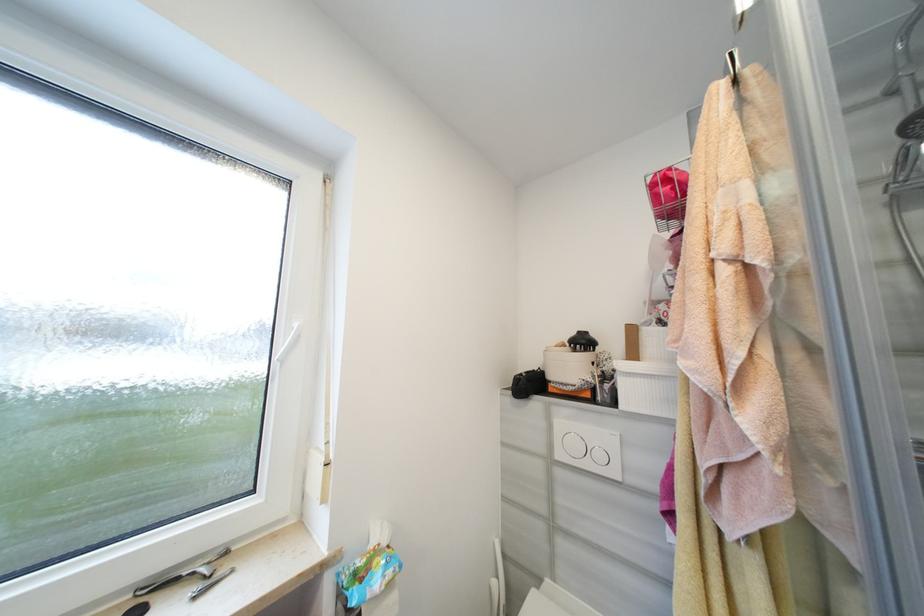
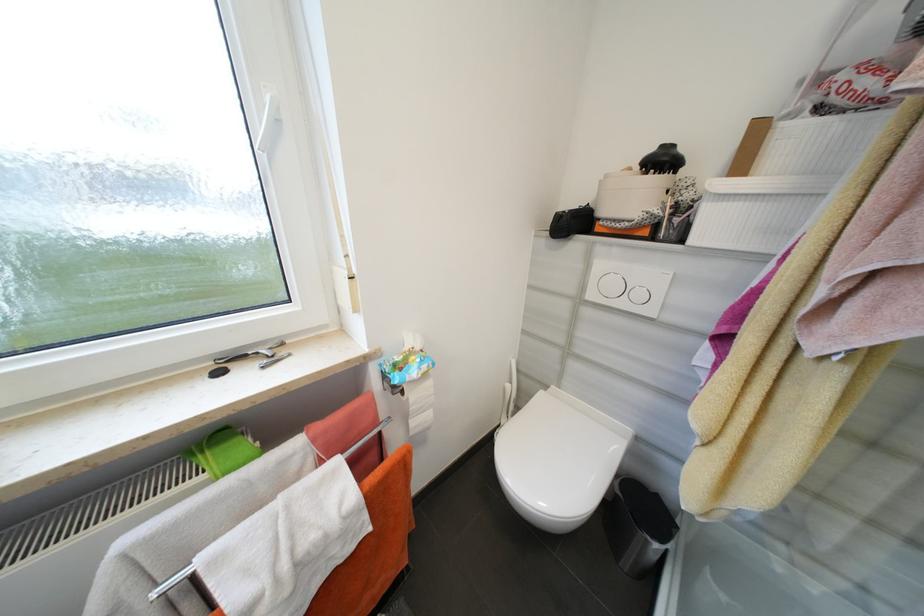
Locate, in the second image, the point that corresponds to (523,381) in the first image.

(565, 217)